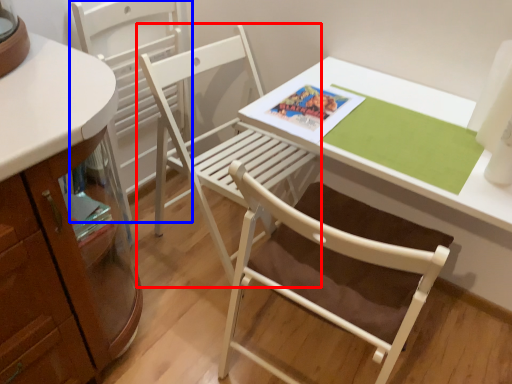
Question: Which object is further to the camera taking this photo, chair (highlighted by a red box) or chair (highlighted by a blue box)?

Choices:
 (A) chair
 (B) chair

Answer: (B)